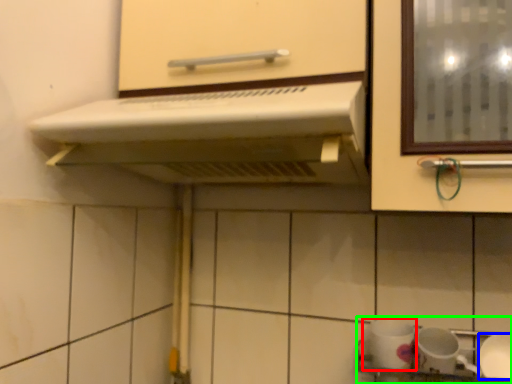
Question: Which is farther away from tableware (highlighted by a red box)? tableware (highlighted by a blue box) or sink (highlighted by a green box)?

Choices:
 (A) tableware
 (B) sink

Answer: (A)